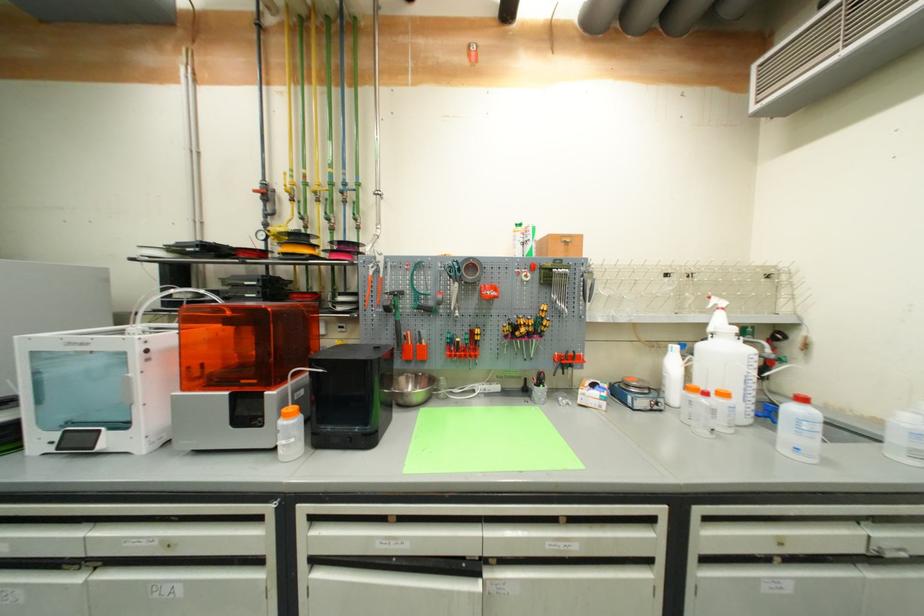
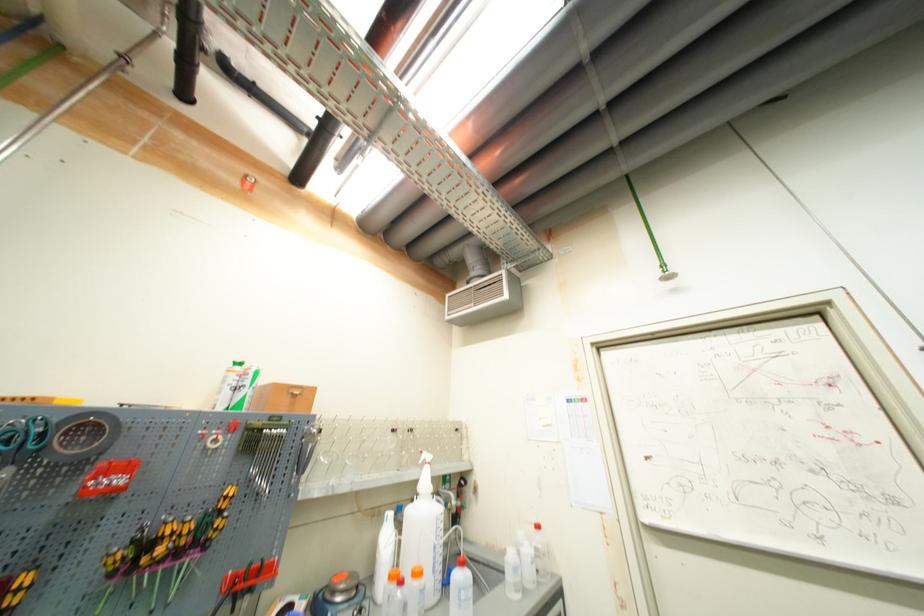
Find the pixel in the second image that matches the point at 482,333 in the first image.

(30, 581)